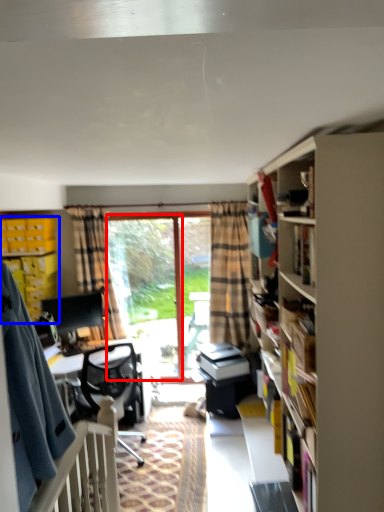
Question: Which of the following is the farthest to the observer, window screen (highlighted by a red box) or cabinet (highlighted by a blue box)?

Choices:
 (A) window screen
 (B) cabinet

Answer: (A)